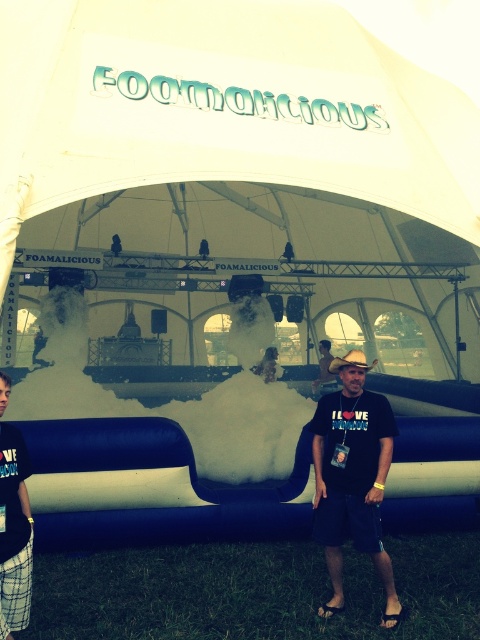
Who is more forward, (x=159, y=412) or (x=13, y=449)?

Point (x=13, y=449)

Can you confirm if white fluffy foam at center is positioned to the left of plaid shorts at lower left?

In fact, white fluffy foam at center is to the right of plaid shorts at lower left.

Does point (229, 436) lie behind point (2, 497)?

Yes, it is behind point (2, 497).

Where is `white fluffy foam at center`? white fluffy foam at center is located at coordinates (168, 404).

Between point (121, 406) and point (351, 362), which one is positioned in front?

Point (351, 362) is in front.

Measure the distance between point (73, 412) and camera.

A distance of 29.21 feet exists between point (73, 412) and camera.

What are the coordinates of `white fluffy foam at center` in the screenshot? It's located at (168, 404).

Does point (328, 496) come farther from viewer compared to point (321, 346)?

No, it is not.

Between black matte t-shirt at center and matte black cowboy hat at center, which one is positioned higher?

Positioned higher is matte black cowboy hat at center.

Is point (317, 536) closer to viewer compared to point (324, 369)?

Yes, it is.

You are a GUI agent. You are given a task and a screenshot of the screen. Output one action in this format:
    pyautogui.click(x=<x>, y=<y>)
    Task: Click on the black matte t-shirt at center
    This screenshot has width=480, height=640.
    Given the screenshot: What is the action you would take?
    pyautogui.click(x=352, y=481)